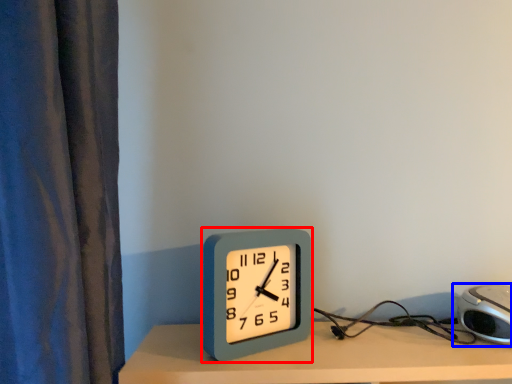
Question: Among these objects, which one is farthest to the camera, alarm clock (highlighted by a red box) or alarm clock (highlighted by a blue box)?

Choices:
 (A) alarm clock
 (B) alarm clock

Answer: (A)